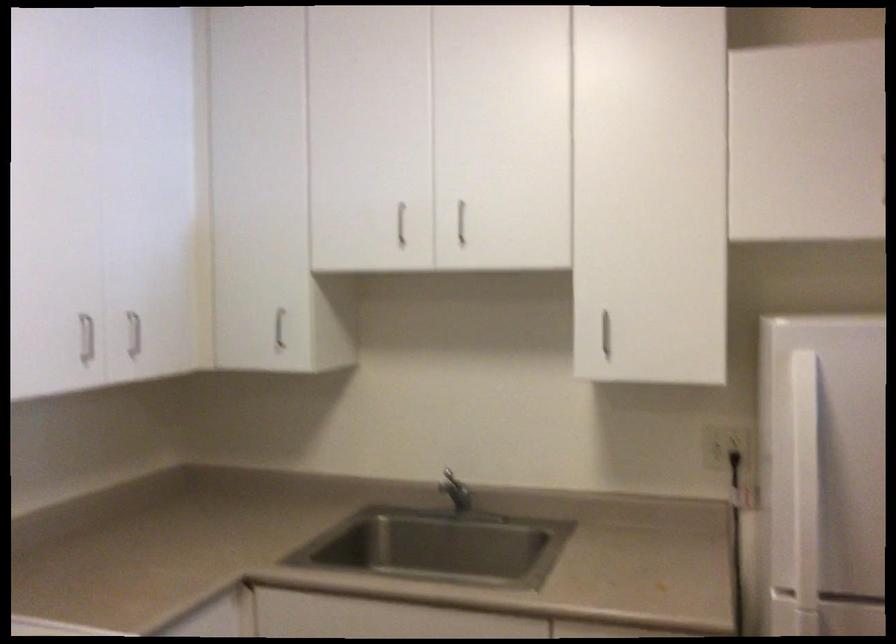
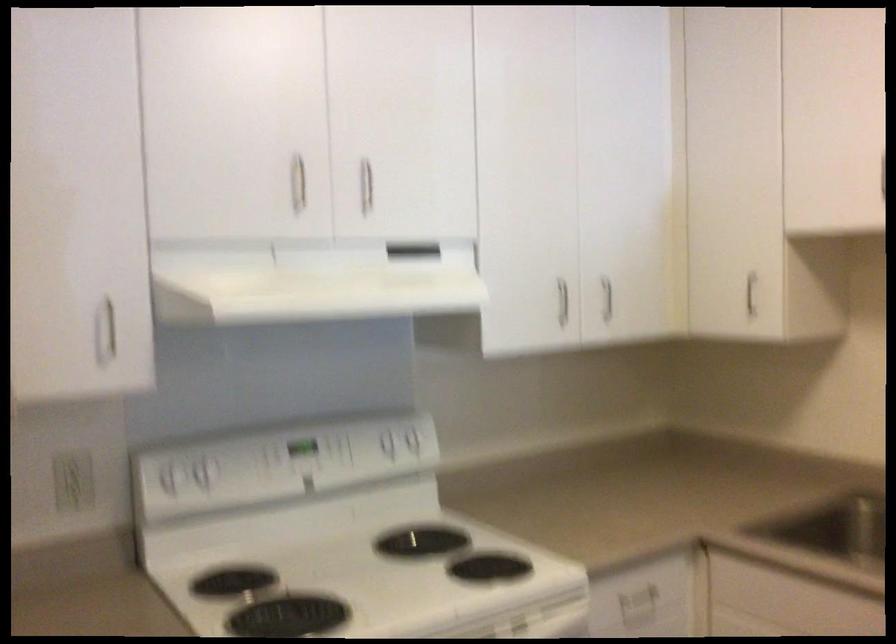
The point at (277, 327) is marked in the first image. Where is the corresponding point in the second image?

(751, 292)